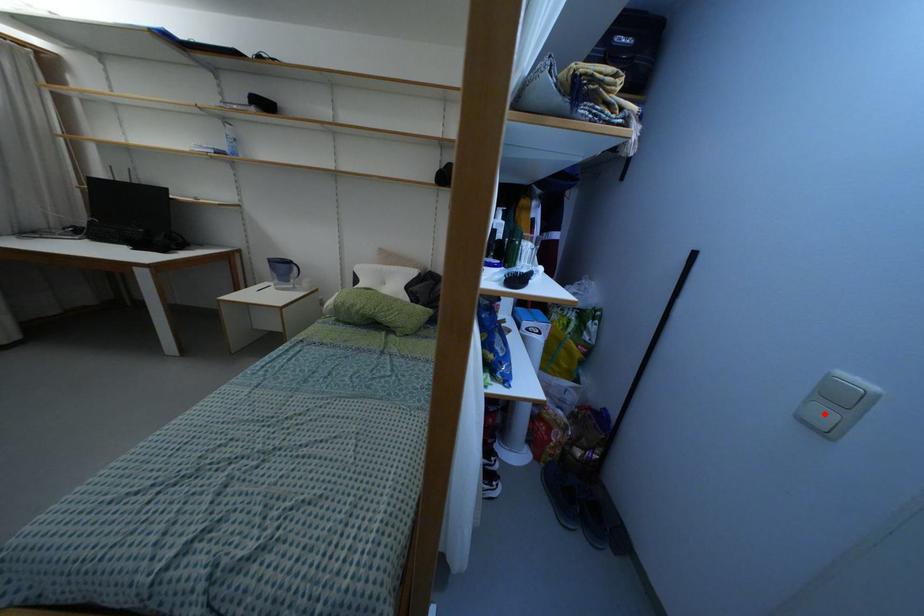
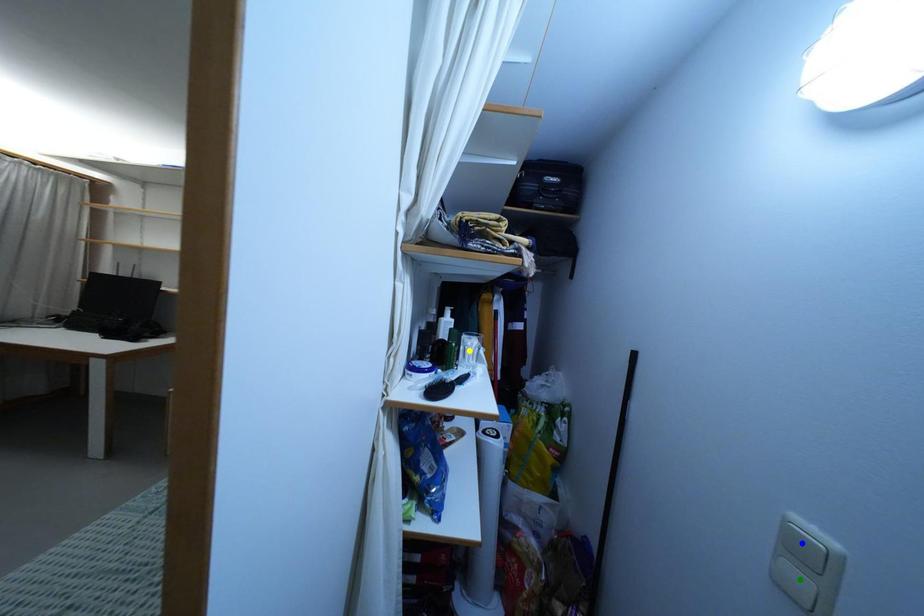
Question: I am providing you with two images of the same scene from different viewpoints. A red point is marked on the first image. You are given multiple points on the second image. Which spot in image 2 lines up with the point in image 1?

Choices:
 (A) green point
 (B) yellow point
 (C) blue point

Answer: (A)